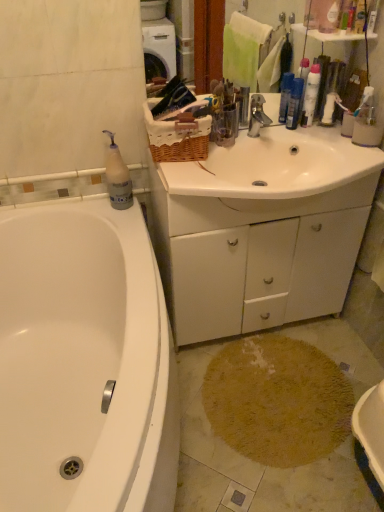
The height and width of the screenshot is (512, 384). In order to click on blank space situated above beige shaggy rug at lower center (from a real-world perspective) in this screenshot , I will do `click(282, 398)`.